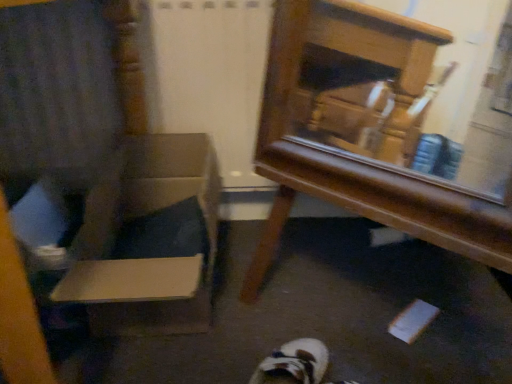
This screenshot has height=384, width=512. I want to click on cardboard box at left, so click(x=148, y=239).

I want to click on wooden mirror at center, so click(x=384, y=130).

Locate an element on the screen. Image resolution: width=512 pixels, height=384 pixels. cardboard box at left is located at coordinates (148, 239).

What's the angular difference between wooden mirror at center and cardboard box at left's facing directions?

47.7 degrees.

Looking at this image, can you confirm if wooden mirror at center is thinner than cardboard box at left?

Indeed, wooden mirror at center has a lesser width compared to cardboard box at left.

Would you say wooden mirror at center is a long distance from cardboard box at left?

No, wooden mirror at center is not far from cardboard box at left.

You are a GUI agent. You are given a task and a screenshot of the screen. Output one action in this format:
    pyautogui.click(x=<x>, y=<y>)
    Task: Click on the armchair above the cardboard box at left (from the image's perspective)
    
    Given the screenshot: What is the action you would take?
    pyautogui.click(x=109, y=172)

Can you confirm if cardboard box at left is positioned to the right of wooden armchair at left?

Correct, you'll find cardboard box at left to the right of wooden armchair at left.

From the image's perspective, is cardboard box at left on top of wooden armchair at left?

Incorrect, from the image's perspective, cardboard box at left is lower than wooden armchair at left.

Which is behind, cardboard box at left or wooden armchair at left?

cardboard box at left is further from the camera.

Looking at the image, does wooden mirror at center seem bigger or smaller compared to wooden armchair at left?

Clearly, wooden mirror at center is smaller in size than wooden armchair at left.

Is wooden mirror at center thinner than wooden armchair at left?

Correct, the width of wooden mirror at center is less than that of wooden armchair at left.

From a real-world perspective, is wooden mirror at center located higher than wooden armchair at left?

No, from a real-world perspective, wooden mirror at center is not over wooden armchair at left

Measure the distance between wooden mirror at center and wooden armchair at left.

They are 15.13 inches apart.

Can you confirm if wooden armchair at left is positioned to the right of wooden mirror at center?

Incorrect, wooden armchair at left is not on the right side of wooden mirror at center.

From a real-world perspective, between wooden armchair at left and wooden mirror at center, who is vertically lower?

wooden mirror at center is physically lower.

Does cardboard box at left contain wooden mirror at center?

No, wooden mirror at center is not inside cardboard box at left.

Is cardboard box at left next to wooden mirror at center and touching it?

cardboard box at left and wooden mirror at center are not in contact.

Is cardboard box at left taller than wooden mirror at center?

In fact, cardboard box at left may be shorter than wooden mirror at center.

Which object is more forward, cardboard box at left or wooden mirror at center?

wooden mirror at center is in front.

Can you confirm if wooden armchair at left is taller than cardboard box at left?

Yes, wooden armchair at left is taller than cardboard box at left.

At what (x,y) coordinates should I click in order to perform the action: click on armchair that appears on the left of cardboard box at left. Please return your answer as a coordinate pair (x, y). Looking at the image, I should click on (109, 172).

Which point is more distant from viewer, [106,169] or [181,324]?

The point [106,169] is behind.

Does wooden armchair at left have a greater width compared to cardboard box at left?

Yes, wooden armchair at left is wider than cardboard box at left.

At what (x,y) coordinates should I click in order to perform the action: click on furniture above the cardboard box at left (from the image's perspective). Please return your answer as a coordinate pair (x, y). Looking at the image, I should click on (384, 130).

In order to click on armchair located in front of the cardboard box at left in this screenshot , I will do `click(109, 172)`.

When comparing their distances from wooden armchair at left, does cardboard box at left or wooden mirror at center seem closer?

cardboard box at left lies closer to wooden armchair at left than the other object.

Estimate the real-world distances between objects in this image. Which object is further from wooden mirror at center, wooden armchair at left or cardboard box at left?

wooden armchair at left is further to wooden mirror at center.

Considering their positions, is wooden mirror at center positioned further to cardboard box at left than wooden armchair at left?

wooden mirror at center lies further to cardboard box at left than the other object.

Which object lies nearer to the anchor point wooden armchair at left, wooden mirror at center or cardboard box at left?

cardboard box at left lies closer to wooden armchair at left than the other object.

When comparing their distances from wooden mirror at center, does cardboard box at left or wooden armchair at left seem further?

wooden armchair at left is positioned further to the anchor wooden mirror at center.

From the image, which object appears to be farther from cardboard box at left, wooden armchair at left or wooden mirror at center?

wooden mirror at center is positioned further to the anchor cardboard box at left.

In order to click on cardboard box located between wooden armchair at left and wooden mirror at center in the left-right direction in this screenshot , I will do `click(148, 239)`.